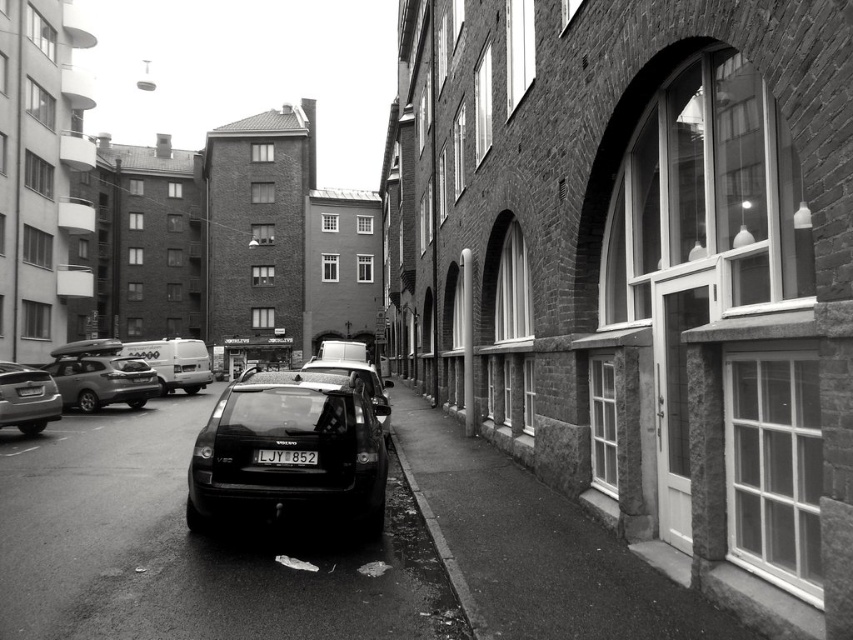
Question: Among these objects, which one is nearest to the camera?

Choices:
 (A) shiny black car at center
 (B) matte black suv at left
 (C) smooth asphalt curb at lower center

Answer: (C)

Question: Does shiny black sedan at left appear over white matte van at center-left?

Choices:
 (A) no
 (B) yes

Answer: (A)

Question: Based on their relative distances, which object is farther from the smooth asphalt curb at lower center?

Choices:
 (A) matte black suv at left
 (B) shiny black sedan at left
 (C) black matte car at center
 (D) white matte van at center-left

Answer: (D)

Question: Considering the relative positions of black matte car at center and shiny black car at center in the image provided, where is black matte car at center located with respect to shiny black car at center?

Choices:
 (A) above
 (B) below

Answer: (B)

Question: Does matte black suv at left appear under shiny black car at center?

Choices:
 (A) yes
 (B) no

Answer: (B)

Question: Which of the following is the farthest from the observer?

Choices:
 (A) (421, 500)
 (B) (358, 360)

Answer: (B)